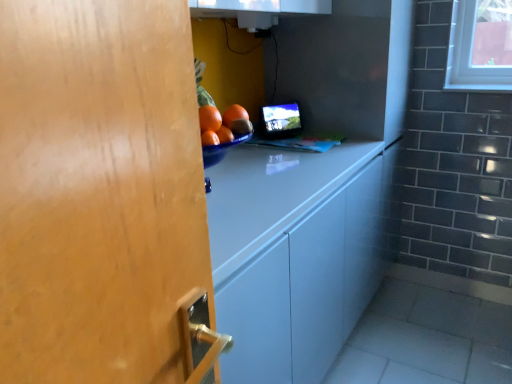
Question: Is matte black monitor at center smaller than white glossy cabinet at center?

Choices:
 (A) no
 (B) yes

Answer: (B)

Question: Are matte black monitor at center and white glossy cabinet at center beside each other?

Choices:
 (A) yes
 (B) no

Answer: (B)

Question: Does matte black monitor at center appear on the left side of white glossy cabinet at center?

Choices:
 (A) no
 (B) yes

Answer: (B)

Question: Can you confirm if matte black monitor at center is wider than white glossy cabinet at center?

Choices:
 (A) yes
 (B) no

Answer: (B)

Question: Does matte black monitor at center have a lesser width compared to white glossy cabinet at center?

Choices:
 (A) yes
 (B) no

Answer: (A)

Question: Does matte black monitor at center have a larger size compared to white glossy cabinet at center?

Choices:
 (A) no
 (B) yes

Answer: (A)

Question: Is white glossy cabinet at center with matte black monitor at center?

Choices:
 (A) yes
 (B) no

Answer: (B)

Question: Can you confirm if white glossy cabinet at center is shorter than matte black monitor at center?

Choices:
 (A) yes
 (B) no

Answer: (B)

Question: Is white glossy cabinet at center closer to camera compared to matte black monitor at center?

Choices:
 (A) no
 (B) yes

Answer: (B)

Question: Does white glossy cabinet at center have a greater height compared to matte black monitor at center?

Choices:
 (A) no
 (B) yes

Answer: (B)

Question: Considering the relative sizes of white glossy cabinet at center and matte black monitor at center in the image provided, is white glossy cabinet at center thinner than matte black monitor at center?

Choices:
 (A) no
 (B) yes

Answer: (A)

Question: From the image's perspective, is white glossy cabinet at center below matte black monitor at center?

Choices:
 (A) yes
 (B) no

Answer: (A)

Question: Based on their sizes in the image, would you say matte black monitor at center is bigger or smaller than white glossy cabinet at center?

Choices:
 (A) big
 (B) small

Answer: (B)